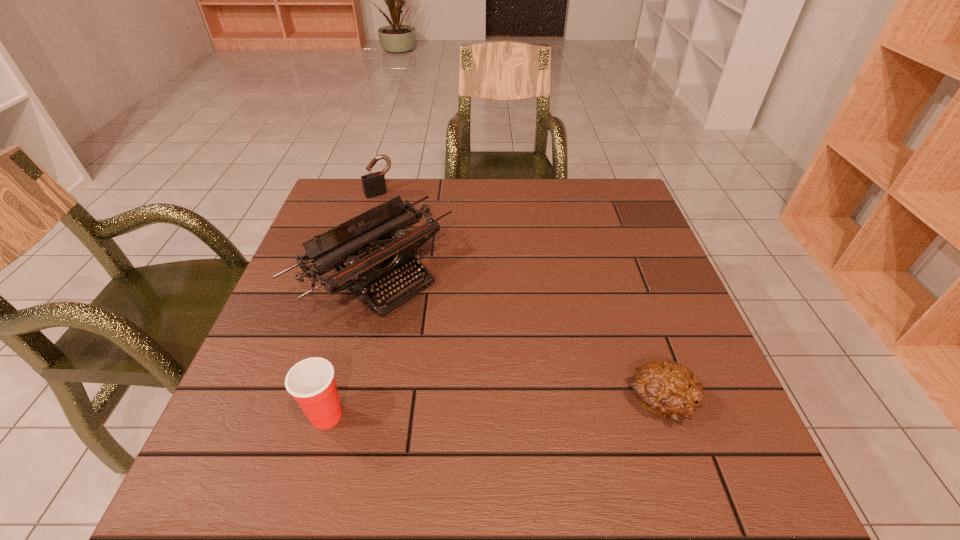
Find the location of a particular element. The width and height of the screenshot is (960, 540). object that ranks as the second closest to the padlock is located at coordinates (311, 382).

Where is `free location that satisfies the following two spatial constraints: 1. on the front side of the typewriter; 2. on the left side of the muffin`? This screenshot has width=960, height=540. free location that satisfies the following two spatial constraints: 1. on the front side of the typewriter; 2. on the left side of the muffin is located at coordinates (345, 403).

Where is `free spot that satisfies the following two spatial constraints: 1. on the front side of the padlock; 2. on the left side of the Dixie cup`? This screenshot has width=960, height=540. free spot that satisfies the following two spatial constraints: 1. on the front side of the padlock; 2. on the left side of the Dixie cup is located at coordinates (312, 415).